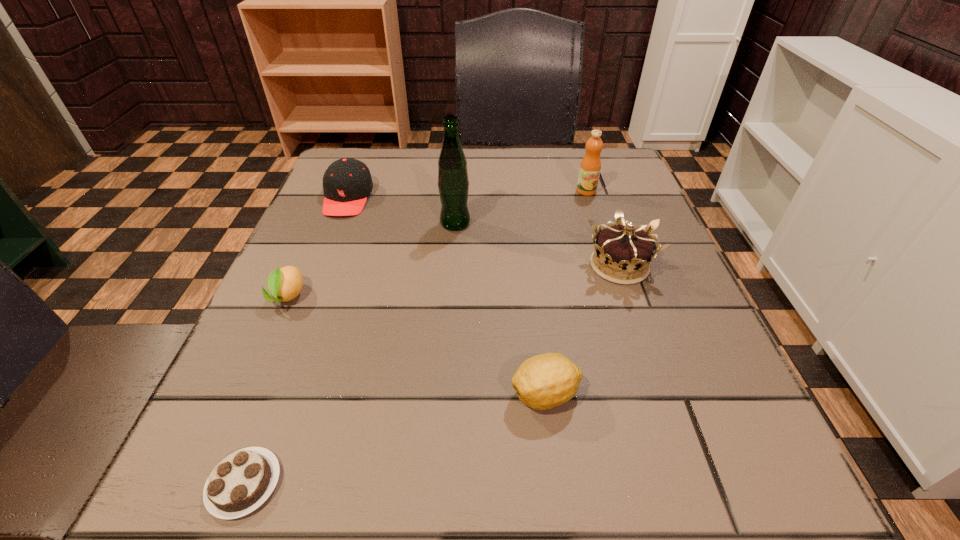
The width and height of the screenshot is (960, 540). I want to click on free space that satisfies the following two spatial constraints: 1. on the front-facing side of the cap; 2. on the left side of the beer bottle, so click(x=338, y=223).

Locate an element on the screen. free space that satisfies the following two spatial constraints: 1. on the front-facing side of the beer bottle; 2. on the left side of the cap is located at coordinates (338, 223).

Identify the location of free spot that satisfies the following two spatial constraints: 1. on the front label of the orange juice; 2. on the left side of the third tallest object. (611, 266).

This screenshot has width=960, height=540. Find the location of `vacant space that satisfies the following two spatial constraints: 1. on the front label of the sixth shortest object; 2. at the stem end of the right lemon`. vacant space that satisfies the following two spatial constraints: 1. on the front label of the sixth shortest object; 2. at the stem end of the right lemon is located at coordinates (653, 395).